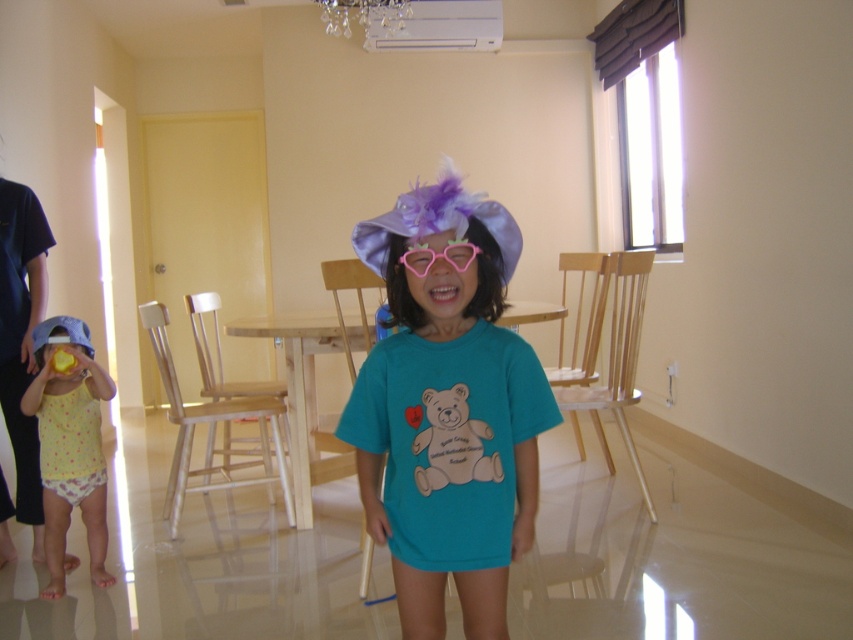
Is matte purple hat at center above pink plastic goggles at center?

Actually, matte purple hat at center is below pink plastic goggles at center.

Is matte purple hat at center thinner than pink plastic goggles at center?

Incorrect, matte purple hat at center's width is not less than pink plastic goggles at center's.

What do you see at coordinates (447, 412) in the screenshot? The height and width of the screenshot is (640, 853). I see `matte purple hat at center` at bounding box center [447, 412].

Find the location of a particular element. This screenshot has height=640, width=853. matte purple hat at center is located at coordinates (447, 412).

Which is in front, point (445, 355) or point (68, 467)?

Positioned in front is point (445, 355).

Is matte purple hat at center positioned before yellow dotted fabric at left?

Yes, it is.

Is point (500, 612) positioned before point (54, 458)?

Yes, it is.

At what (x,y) coordinates should I click in order to perform the action: click on matte purple hat at center. Please return your answer as a coordinate pair (x, y). Image resolution: width=853 pixels, height=640 pixels. Looking at the image, I should click on (447, 412).

Between yellow dotted fabric at left and pink plastic goggles at center, which one appears on the left side from the viewer's perspective?

yellow dotted fabric at left is more to the left.

Which is behind, point (47, 365) or point (413, 266)?

The point (47, 365) is behind.

Find the location of a particular element. This screenshot has height=640, width=853. yellow dotted fabric at left is located at coordinates (68, 444).